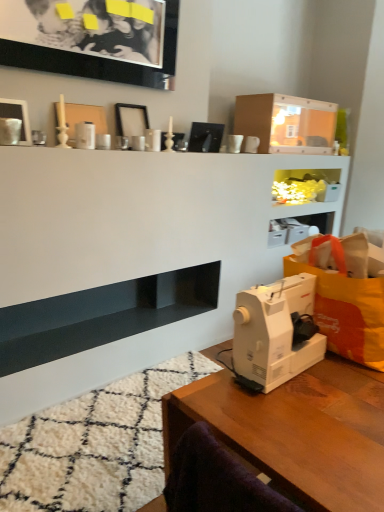
Question: Is translucent plastic cabinet at upper center thinner than wooden table at lower right?

Choices:
 (A) no
 (B) yes

Answer: (B)

Question: Is translucent plastic cabinet at upper center to the left of wooden table at lower right from the viewer's perspective?

Choices:
 (A) no
 (B) yes

Answer: (A)

Question: Considering the relative sizes of translucent plastic cabinet at upper center and wooden table at lower right in the image provided, is translucent plastic cabinet at upper center smaller than wooden table at lower right?

Choices:
 (A) yes
 (B) no

Answer: (A)

Question: Is translucent plastic cabinet at upper center positioned behind wooden table at lower right?

Choices:
 (A) yes
 (B) no

Answer: (A)

Question: From a real-world perspective, is translucent plastic cabinet at upper center beneath wooden table at lower right?

Choices:
 (A) yes
 (B) no

Answer: (B)

Question: Can you confirm if translucent plastic cabinet at upper center is bigger than wooden table at lower right?

Choices:
 (A) yes
 (B) no

Answer: (B)

Question: Is translucent plastic cabinet at upper center not within white matte picture frame at upper center, which ranks as the second picture frame in bottom-to-top order?

Choices:
 (A) no
 (B) yes

Answer: (B)

Question: Is translucent plastic cabinet at upper center not near white matte picture frame at upper center, which ranks as the second picture frame in bottom-to-top order?

Choices:
 (A) no
 (B) yes

Answer: (B)

Question: From the image's perspective, is translucent plastic cabinet at upper center beneath white matte picture frame at upper center, the second picture frame from the top?

Choices:
 (A) yes
 (B) no

Answer: (A)

Question: Does translucent plastic cabinet at upper center appear on the right side of white matte picture frame at upper center, the second picture frame from the top?

Choices:
 (A) no
 (B) yes

Answer: (B)

Question: Can you confirm if translucent plastic cabinet at upper center is shorter than white matte picture frame at upper center, which ranks as the second picture frame in bottom-to-top order?

Choices:
 (A) yes
 (B) no

Answer: (A)

Question: Can you confirm if translucent plastic cabinet at upper center is thinner than white matte picture frame at upper center, which ranks as the second picture frame in bottom-to-top order?

Choices:
 (A) no
 (B) yes

Answer: (A)

Question: Are matte cardboard box at upper center and black glossy picture frame at upper left, marked as the 3th picture frame in a bottom-to-top arrangement, located far from each other?

Choices:
 (A) no
 (B) yes

Answer: (B)